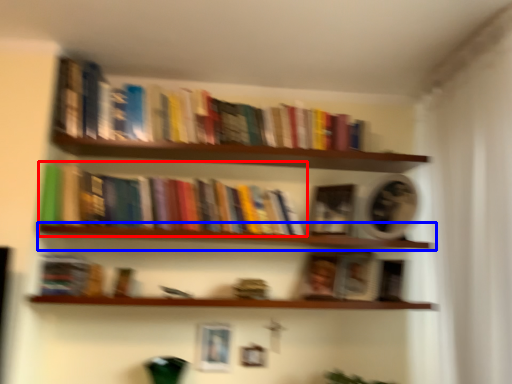
Question: Among these objects, which one is farthest to the camera, book (highlighted by a red box) or window sill (highlighted by a blue box)?

Choices:
 (A) book
 (B) window sill

Answer: (A)